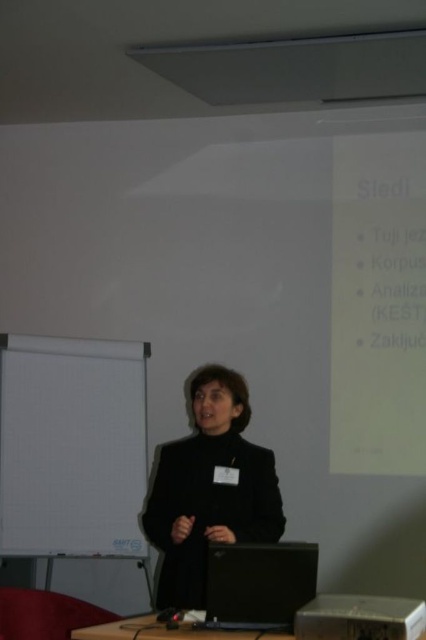
Question: Is black matte jacket at center positioned before black plastic table at lower center?

Choices:
 (A) no
 (B) yes

Answer: (A)

Question: Among these points, which one is nearest to the camera?

Choices:
 (A) (167, 465)
 (B) (302, 557)
 (C) (409, 636)

Answer: (C)

Question: Is black matte jacket at center thinner than black plastic laptop at lower center?

Choices:
 (A) no
 (B) yes

Answer: (A)

Question: Which object appears closest to the camera in this image?

Choices:
 (A) black plastic table at lower center
 (B) black plastic laptop at lower center
 (C) white paper at center
 (D) black plastic projector at lower center

Answer: (D)

Question: Which of the following is the farthest from the observer?

Choices:
 (A) black matte jacket at center
 (B) black plastic table at lower center
 (C) black plastic projector at lower center

Answer: (A)

Question: Observing the image, what is the correct spatial positioning of white paper at center in reference to black matte jacket at center?

Choices:
 (A) above
 (B) below

Answer: (A)